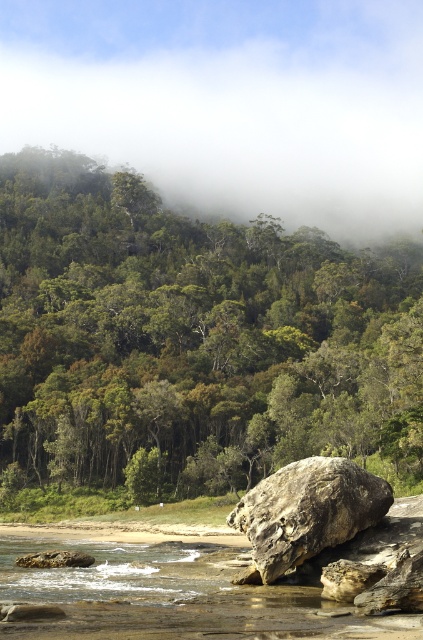
You are standing on the rocky shoreline and want to walk towards the dense forest. You see the green leafy tree at center and the rusty stone boulder at center. Which object should you head towards if you want to reach the forest first?

The green leafy tree at center is to the left of the rusty stone boulder at center. Since you are heading towards the forest, which is in the middle ground, the green leafy tree at center is closer to the forest area, so you should head towards the green leafy tree at center first.

You are standing at the rocky shoreline and want to walk towards the green leafy tree at center and the foggy misty forest at upper center. Which object will you encounter first?

The green leafy tree at center will be encountered first because it is positioned to the right of the foggy misty forest at upper center, making it closer to your starting point at the shoreline.